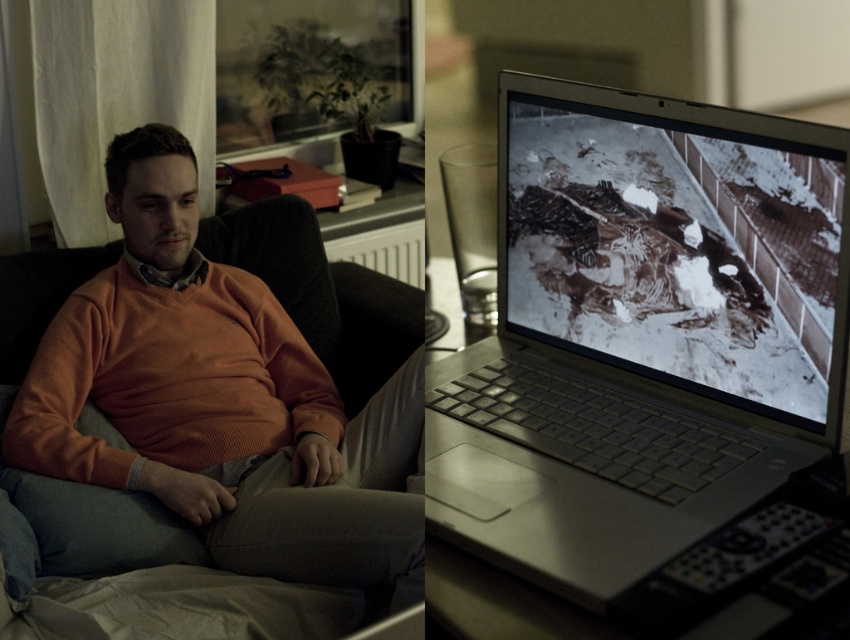
Which of these two, silver metallic laptop at center or orange knitted sweater at center, stands taller?

With more height is orange knitted sweater at center.

Find the location of a particular element. silver metallic laptop at center is located at coordinates (644, 346).

Is point (701, 360) positioned in front of point (190, 420)?

Yes, it is in front of point (190, 420).

Find the location of a particular element. This screenshot has height=640, width=850. silver metallic laptop at center is located at coordinates (x=644, y=346).